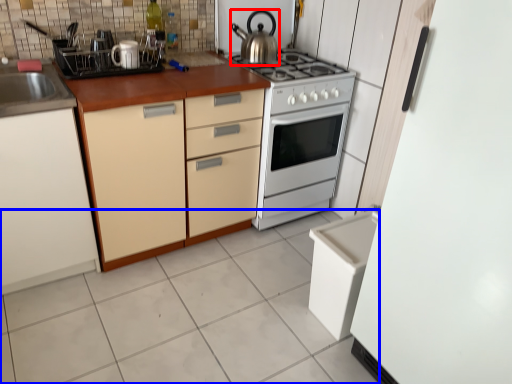
Question: Which object appears closest to the camera in this image, kitchen appliance (highlighted by a red box) or ceramic tile (highlighted by a blue box)?

Choices:
 (A) kitchen appliance
 (B) ceramic tile

Answer: (B)